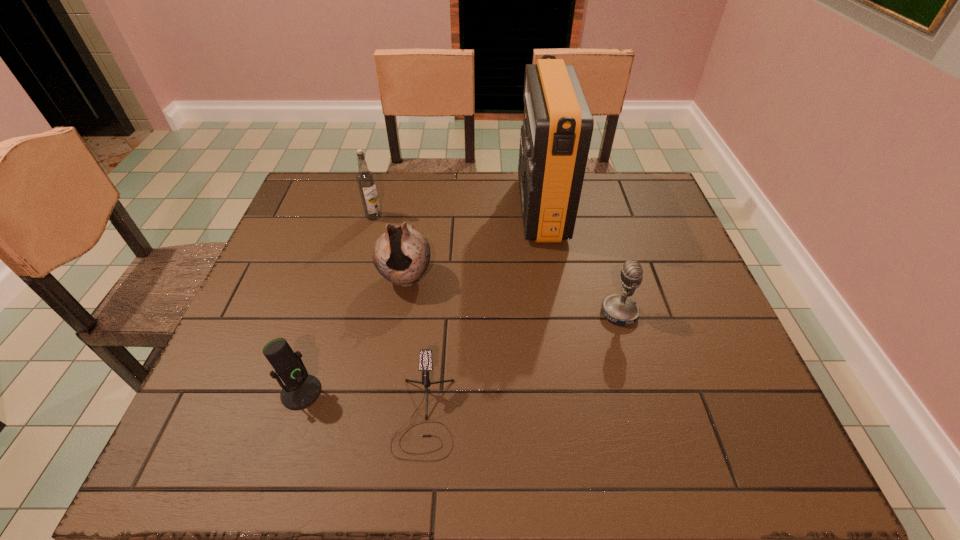
Identify the location of object present at the near edge. (425, 355).

The image size is (960, 540). Identify the location of object that is at the left edge. [301, 389].

Locate an element on the screen. vacant position at the far edge of the desktop is located at coordinates (442, 180).

In order to click on blank space at the near edge of the desktop in this screenshot , I will do `click(679, 471)`.

Locate an element on the screen. This screenshot has height=540, width=960. vacant area at the left edge of the desktop is located at coordinates (274, 315).

In the image, there is a desktop. Identify the location of vacant space at the right edge. (665, 230).

I want to click on vacant space at the far left corner of the desktop, so click(x=319, y=215).

I want to click on free region at the far right corner of the desktop, so click(656, 213).

Where is `vacant space that's between the farthest microphone and the shortest object`? Image resolution: width=960 pixels, height=540 pixels. vacant space that's between the farthest microphone and the shortest object is located at coordinates (522, 364).

At what (x,y) coordinates should I click in order to perform the action: click on free area in between the vodka and the second microphone from left to right. Please return your answer as a coordinate pair (x, y). Image resolution: width=960 pixels, height=540 pixels. Looking at the image, I should click on (399, 316).